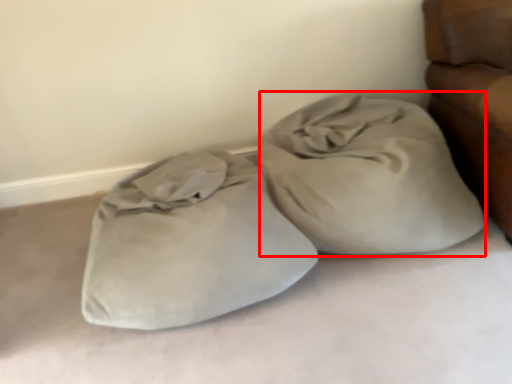
Question: From the image's perspective, where is sack (annotated by the red box) located relative to sleeping bag?

Choices:
 (A) below
 (B) above

Answer: (B)